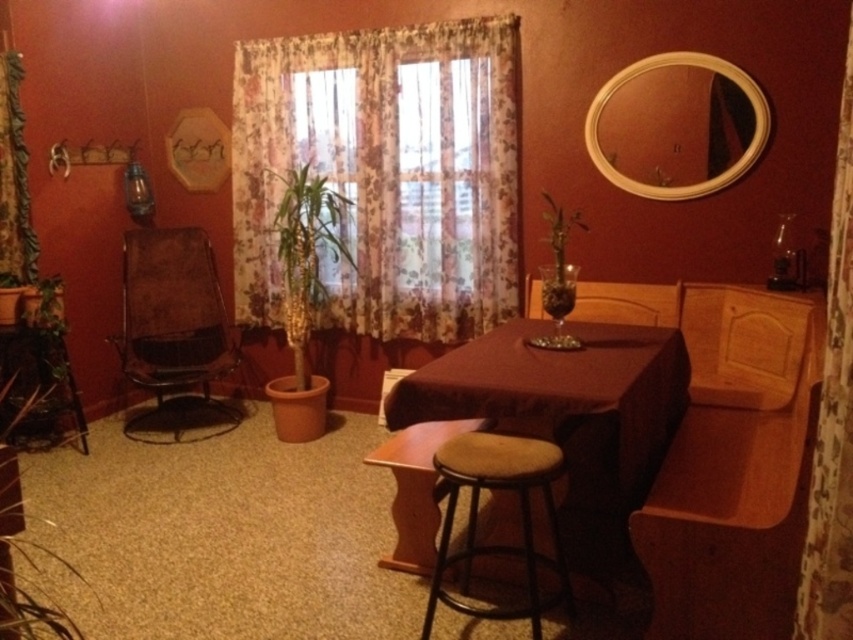
Which of these two, brown fabric chair at left or floral fabric curtain at left, stands shorter?

With less height is brown fabric chair at left.

At what (x,y) coordinates should I click in order to perform the action: click on brown fabric chair at left. Please return your answer as a coordinate pair (x, y). Looking at the image, I should click on (173, 330).

Where is `brown fabric chair at left`? brown fabric chair at left is located at coordinates (173, 330).

Does brown fabric stool at lower center have a larger size compared to green leafy plant in glass vase at center?

No.

Measure the distance between brown fabric stool at lower center and camera.

brown fabric stool at lower center is 1.99 meters away from camera.

Where is `brown fabric stool at lower center`? The height and width of the screenshot is (640, 853). brown fabric stool at lower center is located at coordinates (476, 516).

Is light brown wood bench at lower right bigger than green leafy plant in glass vase at center?

Yes.

Does point (665, 465) come in front of point (544, 196)?

Yes, it is.

Find the location of a particular element. The image size is (853, 640). light brown wood bench at lower right is located at coordinates 735,467.